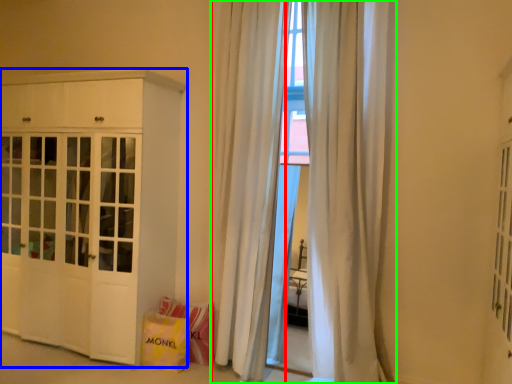
Question: Which object is positioned closest to curtain (highlighted by a red box)? Select from cabinetry (highlighted by a blue box) and curtain (highlighted by a green box).

Choices:
 (A) cabinetry
 (B) curtain

Answer: (B)